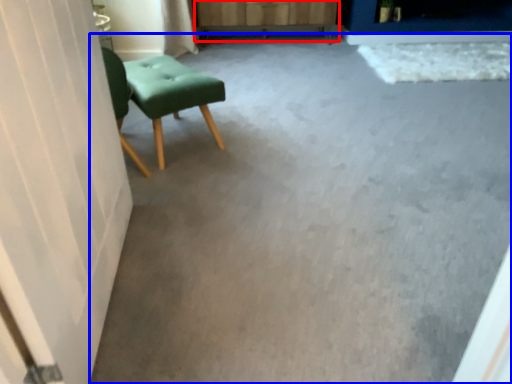
Question: Which object is closer to the camera taking this photo, dresser (highlighted by a red box) or concrete (highlighted by a blue box)?

Choices:
 (A) dresser
 (B) concrete

Answer: (B)